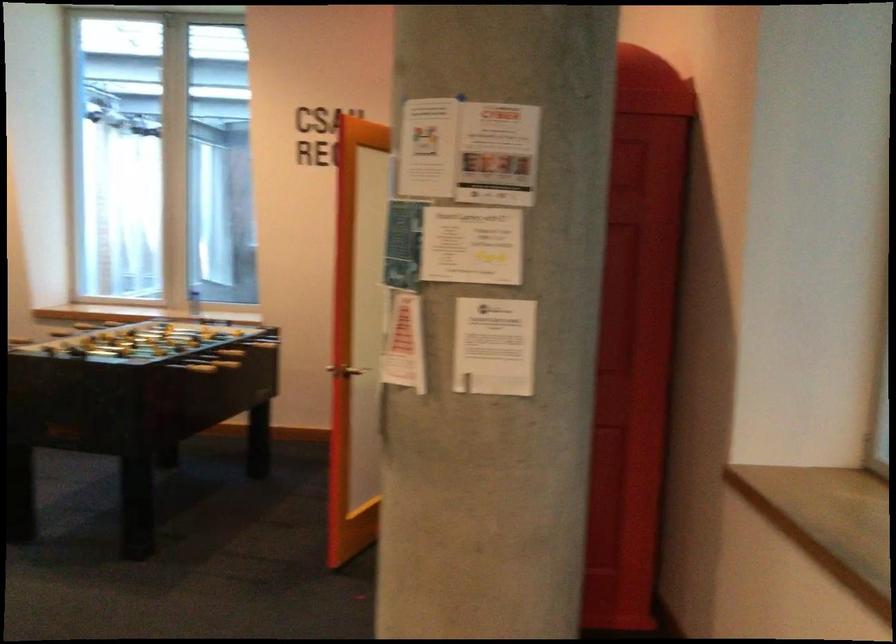
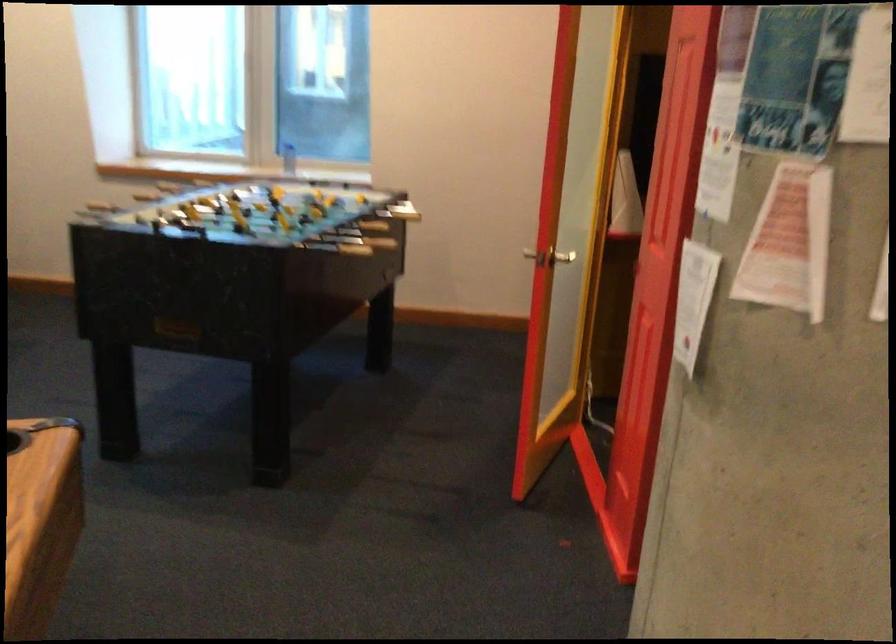
In the second image, find the point that corresponds to (x=357, y=365) in the first image.

(562, 257)